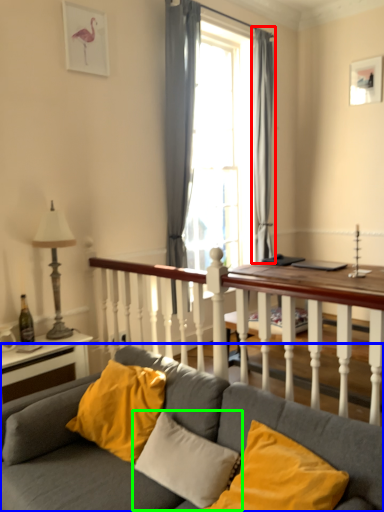
Question: Which object is positioned farthest from curtain (highlighted by a red box)? Select from studio couch (highlighted by a blue box) and pillow (highlighted by a green box).

Choices:
 (A) studio couch
 (B) pillow

Answer: (A)